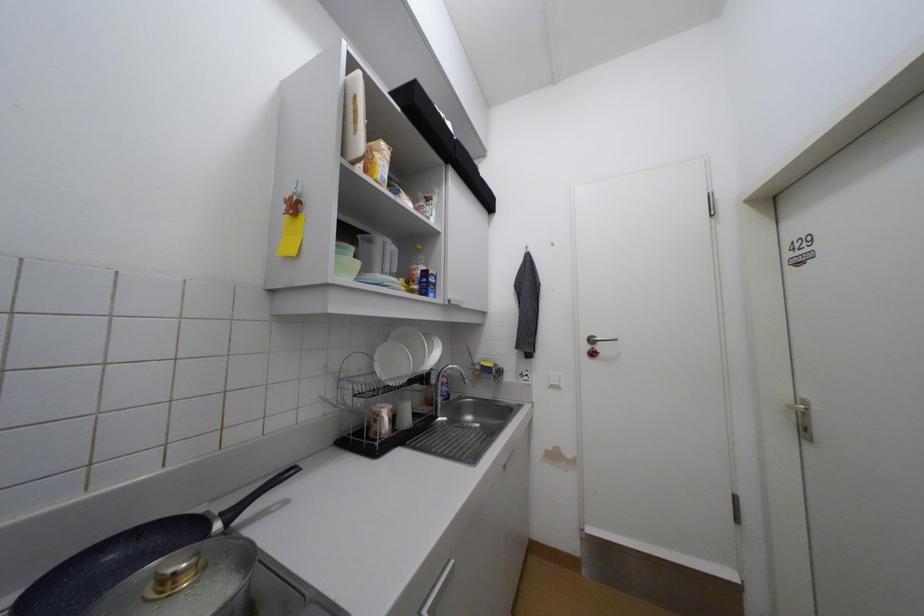
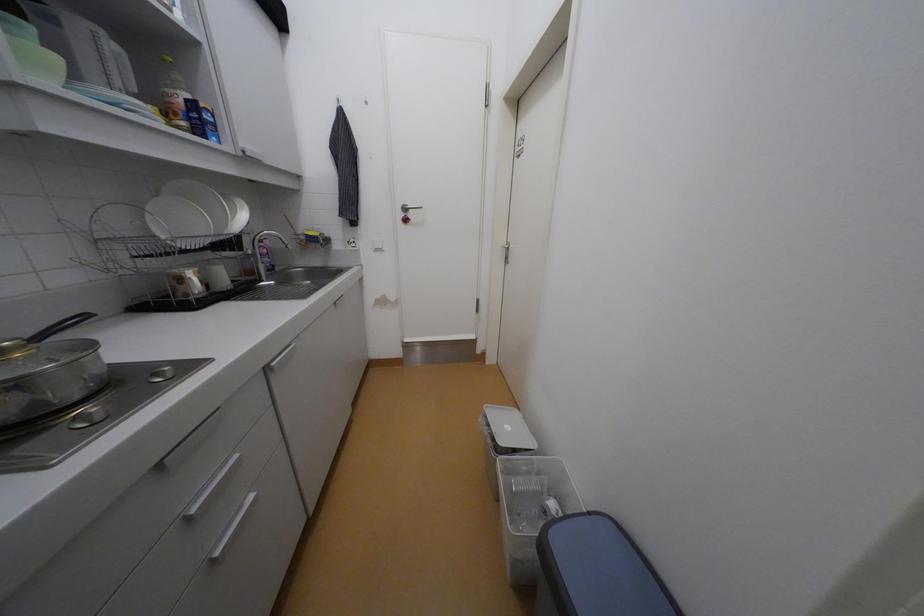
The first image is from the beginning of the video and the second image is from the end. How did the camera likely rotate when shooting the video?

The camera rotated toward right-down.